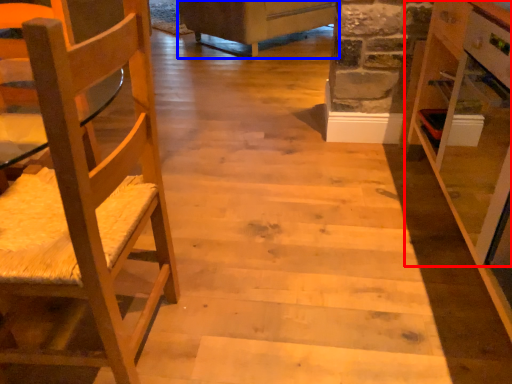
Question: Which object appears closest to the camera in this image, cabinetry (highlighted by a red box) or furniture (highlighted by a blue box)?

Choices:
 (A) cabinetry
 (B) furniture

Answer: (A)